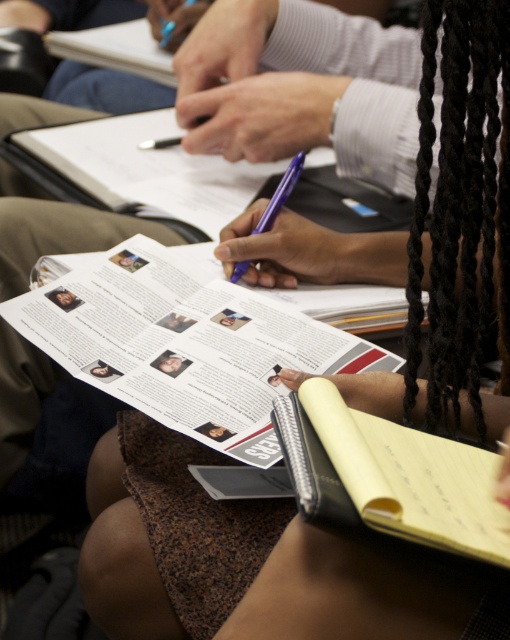
Question: Which object appears farthest from the camera in this image?

Choices:
 (A) yellow paper at center
 (B) yellow paper notebook at lower right

Answer: (A)

Question: Does yellow paper at center have a smaller size compared to yellow paper notebook at lower right?

Choices:
 (A) no
 (B) yes

Answer: (A)

Question: Which point is farther to the camera?

Choices:
 (A) yellow paper at center
 (B) yellow paper notebook at lower right

Answer: (A)

Question: Which point appears farthest from the camera in this image?

Choices:
 (A) (191, 332)
 (B) (451, 460)

Answer: (A)

Question: Does yellow paper at center appear over purple plastic pen at center?

Choices:
 (A) yes
 (B) no

Answer: (B)

Question: Can you confirm if yellow paper notebook at lower right is positioned below purple plastic pen at center?

Choices:
 (A) yes
 (B) no

Answer: (A)